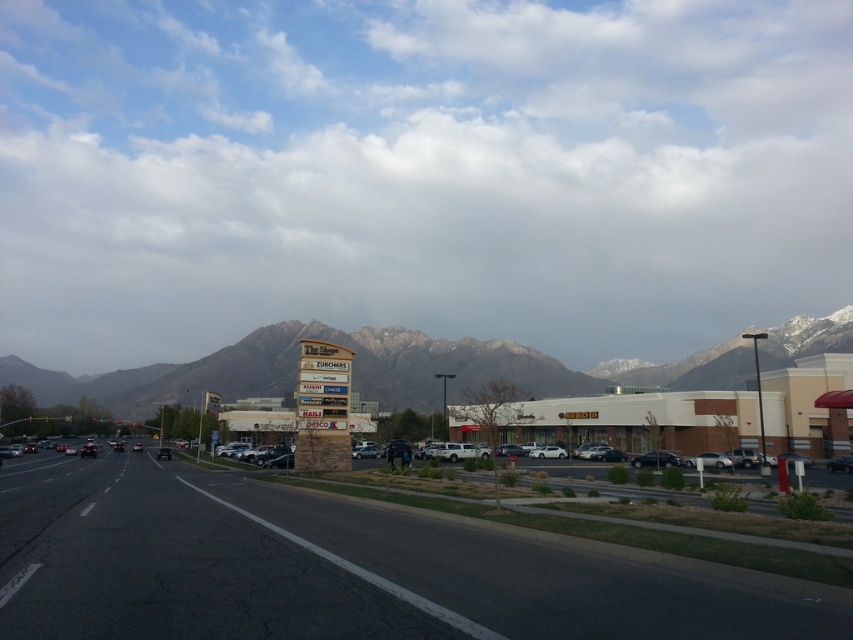
You are a pilot flying a small plane and need to determine which object in the scene, the white fluffy cloud at upper center or the rocky mountain range at center, poses a higher risk of collision based on their sizes. Which one should you be more cautious about?

The white fluffy cloud at upper center is larger in size than the rocky mountain range at center, so you should be more cautious about the white fluffy cloud at upper center as it poses a higher collision risk due to its larger size.

You are a pilot flying an airplane and notice the white fluffy cloud at upper center and the rocky mountain range at center in the distance. Which object is higher in elevation from your perspective?

The white fluffy cloud at upper center is higher in elevation than the rocky mountain range at center because it is positioned above it in the sky.